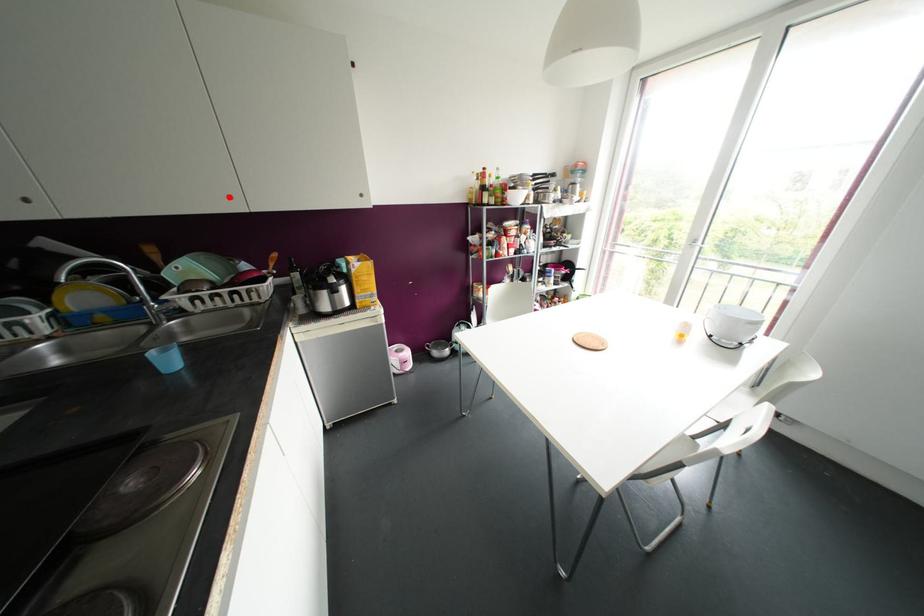
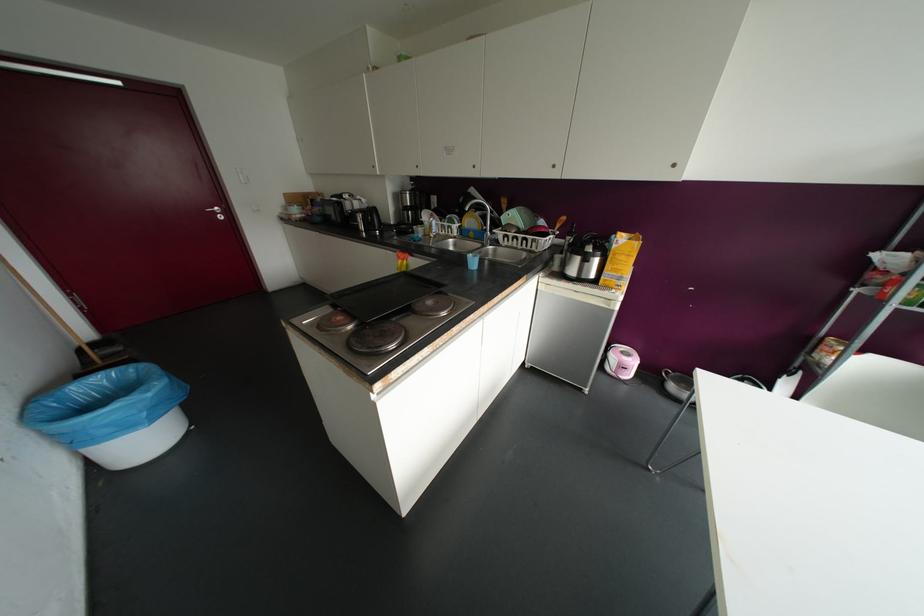
Locate, in the second image, the point that corresponds to the highlighted location in the first image.

(553, 166)